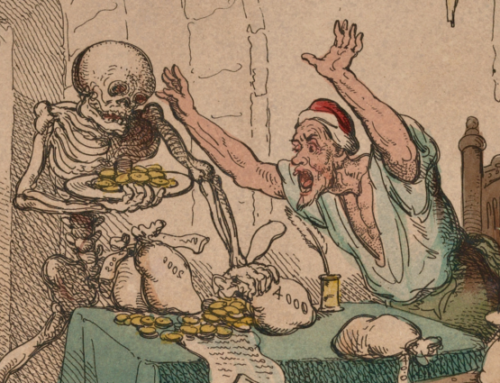
Image resolution: width=500 pixels, height=383 pixels. Identify the location of table. (304, 349).